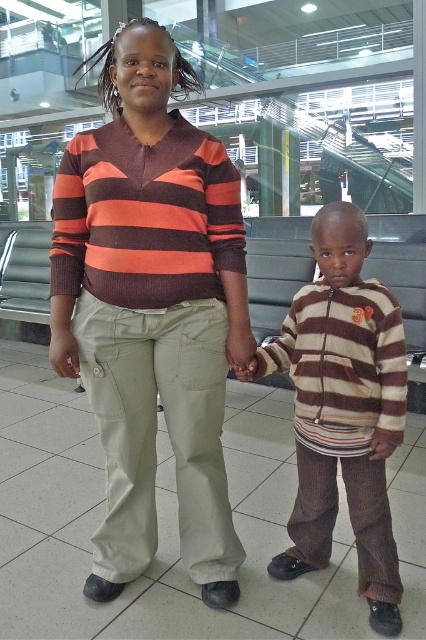
Is point (389, 305) more distant than point (227, 506)?

No, (389, 305) is in front of (227, 506).

Does brown corduroy pants at lower right have a smaller size compared to khaki cotton pants at center?

Incorrect, brown corduroy pants at lower right is not smaller in size than khaki cotton pants at center.

Is point (304, 324) positioned before point (236, 573)?

Yes, it is.

This screenshot has height=640, width=426. In order to click on brown corduroy pants at lower right in this screenshot , I will do `click(342, 410)`.

Does matte striped sweater at center have a lesser height compared to brown corduroy pants at lower right?

No, matte striped sweater at center is not shorter than brown corduroy pants at lower right.

Is point (114, 51) closer to camera compared to point (383, 506)?

Yes, it is.

Where is `matte striped sweater at center`? This screenshot has width=426, height=640. matte striped sweater at center is located at coordinates (152, 308).

Between matte striped sweater at center and khaki cotton pants at center, which one appears on the right side from the viewer's perspective?

From the viewer's perspective, khaki cotton pants at center appears more on the right side.

Is matte striped sweater at center in front of khaki cotton pants at center?

Yes.

Does point (69, 253) come in front of point (169, 392)?

No, (69, 253) is further to viewer.

Find the location of a particular element. This screenshot has height=640, width=426. matte striped sweater at center is located at coordinates (152, 308).